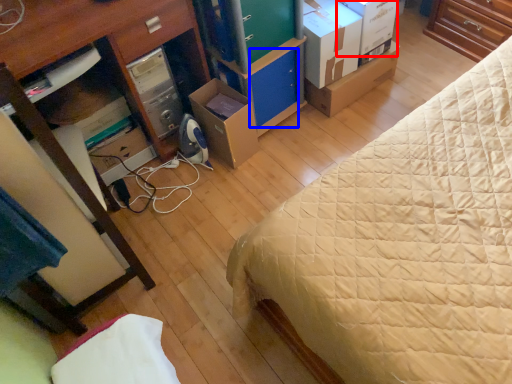
Question: Among these objects, which one is nearest to the camera, storage box (highlighted by a red box) or drawer (highlighted by a blue box)?

Choices:
 (A) storage box
 (B) drawer

Answer: (A)